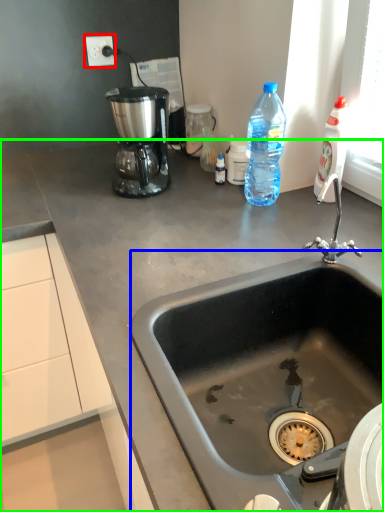
Question: Based on their relative distances, which object is farther from electric outlet (highlighted by a red box)? Choose from sink (highlighted by a blue box) and countertop (highlighted by a green box).

Choices:
 (A) sink
 (B) countertop

Answer: (A)